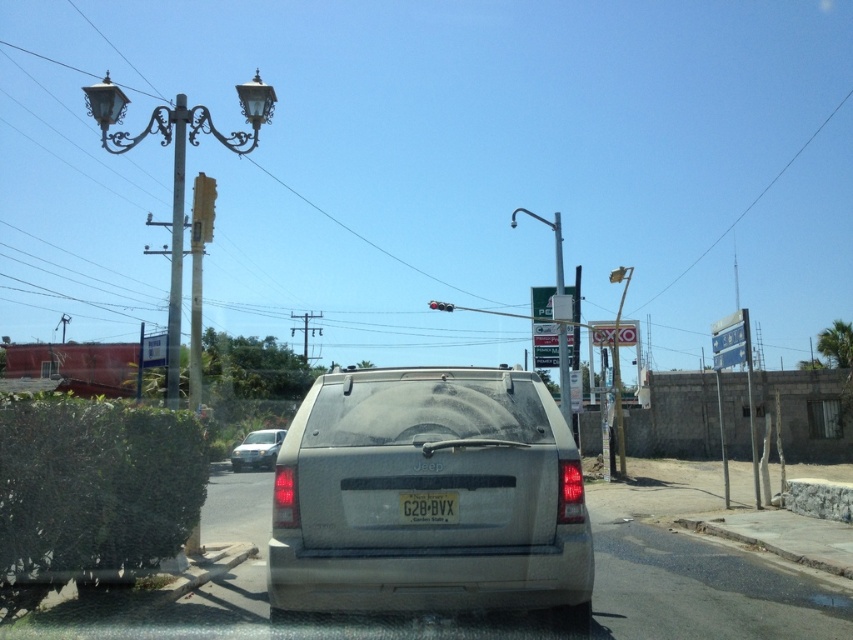
You are a driver trying to parallel park your car. You see the gray matte minivan at center and the metallic traffic light at upper center. Which object is closer to the ground?

The gray matte minivan at center is closer to the ground because it is shorter than the metallic traffic light at upper center.

You are driving a car and see the gray matte minivan at center and the metallic traffic light at upper center in your view. Which object appears narrower in your field of view?

The gray matte minivan at center appears narrower than the metallic traffic light at upper center.

Based on the photo, you are driving and need to park your car. You see a metallic pole at left and a metallic gray signpost at upper center. Which object is closer to your car?

The metallic pole at left is smaller than the metallic gray signpost at upper center, so it is closer to your car.